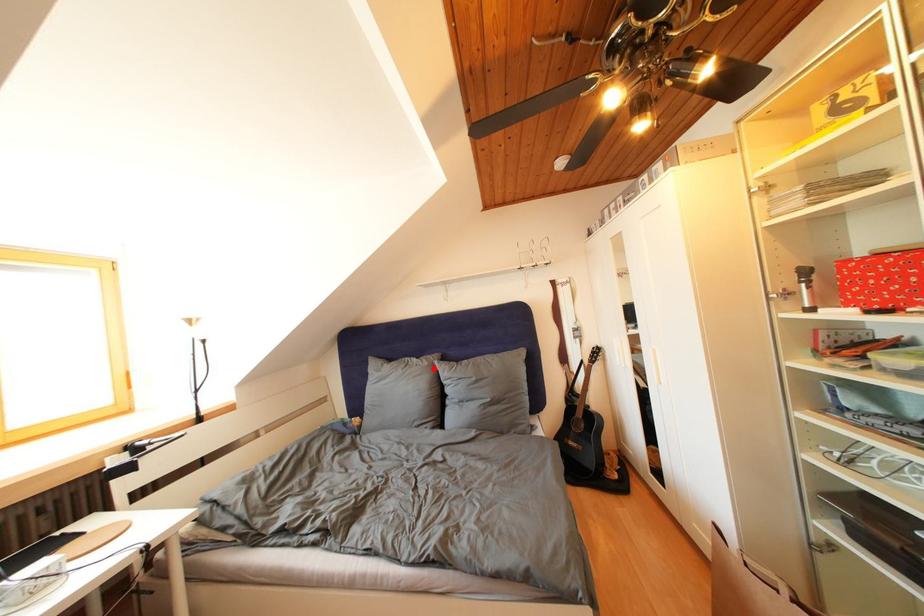
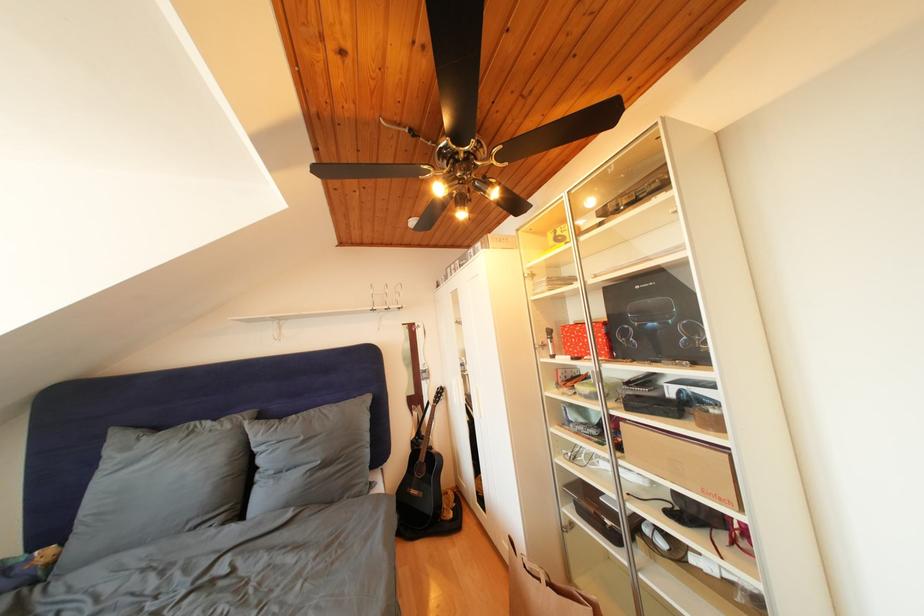
Locate, in the second image, the point that corresponds to the highlighted location in the first image.

(236, 432)